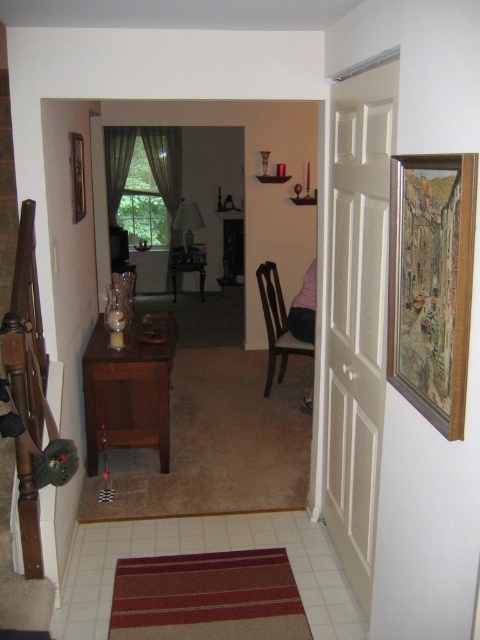
You are planning to place a large potted plant in the hallway. The wooden chair at center and wooden table at center are in the way. Which object should you move to create more space?

The wooden chair at center is larger than the wooden table at center, so moving the wooden chair at center would create more space for the potted plant.

You are a guest entering the hallway and want to sit down. You see a wooden chair at center and a wooden table at center. Which object should you approach to find a place to sit?

The wooden chair at center is the object designed for sitting, so you should approach the wooden chair at center.